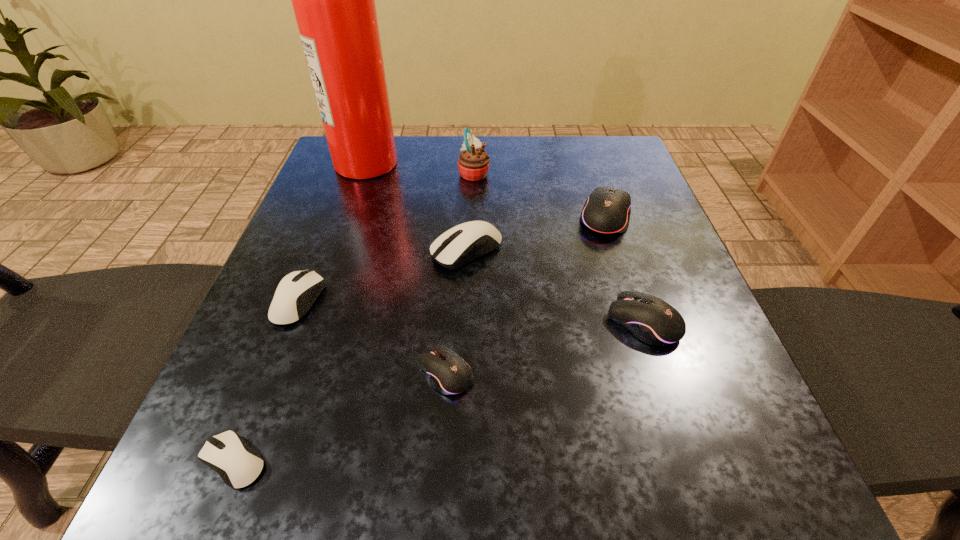
Locate an element on the screen. The width and height of the screenshot is (960, 540). empty space that is in between the leftmost black computer mouse and the biggest white mouse is located at coordinates (456, 312).

You are a GUI agent. You are given a task and a screenshot of the screen. Output one action in this format:
    pyautogui.click(x=<x>, y=<y>)
    Task: Click on the object that can be found as the second closest to the leftmost black computer mouse
    
    Given the screenshot: What is the action you would take?
    pyautogui.click(x=297, y=291)

The width and height of the screenshot is (960, 540). I want to click on object that can be found as the second closest to the second nearest white mouse, so click(x=465, y=242).

Locate an element on the screen. This screenshot has width=960, height=540. mouse that can be found as the closest to the leftmost black computer mouse is located at coordinates (465, 242).

Identify which mouse is the closest to the shortest mouse. Please provide its 2D coordinates. Your answer should be formatted as a tuple, i.e. [(x, y)], where the tuple contains the x and y coordinates of a point satisfying the conditions above.

[(297, 291)]

The height and width of the screenshot is (540, 960). What are the coordinates of `black computer mouse that can be found as the closest to the fire extinguisher` in the screenshot? It's located at pos(607,210).

You are a GUI agent. You are given a task and a screenshot of the screen. Output one action in this format:
    pyautogui.click(x=<x>, y=<y>)
    Task: Click on the black computer mouse that is the second closest one to the biggest white mouse
    The width and height of the screenshot is (960, 540).
    Given the screenshot: What is the action you would take?
    pyautogui.click(x=449, y=374)

Identify which white mouse is located as the second nearest to the tallest mouse. Please provide its 2D coordinates. Your answer should be formatted as a tuple, i.e. [(x, y)], where the tuple contains the x and y coordinates of a point satisfying the conditions above.

[(297, 291)]

This screenshot has height=540, width=960. In order to click on white mouse object that ranks as the closest to the second farthest white mouse in this screenshot , I will do `click(238, 464)`.

What are the coordinates of `free space that satisfies the following two spatial constraints: 1. on the front-facing side of the muffin; 2. on the right side of the second smallest black computer mouse` in the screenshot? It's located at (x=471, y=322).